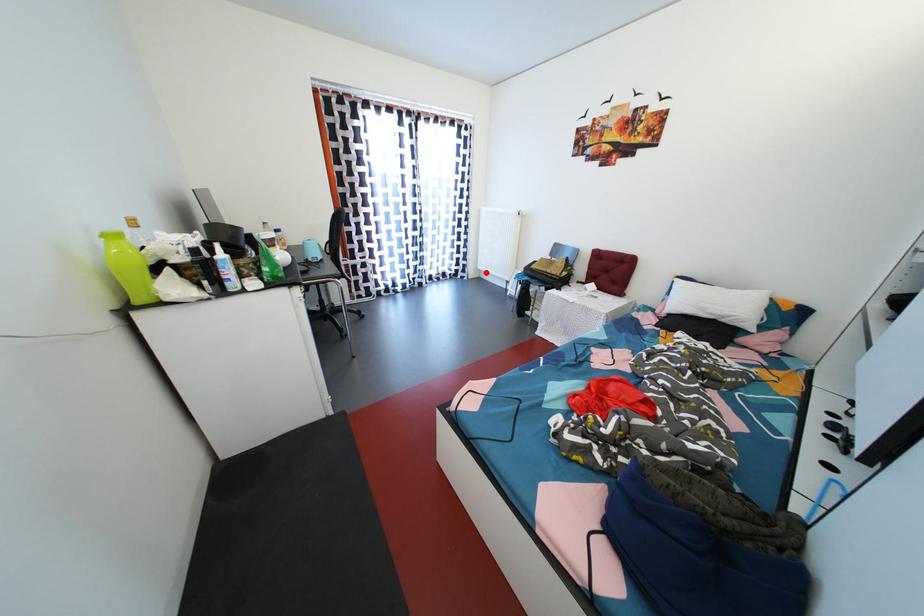
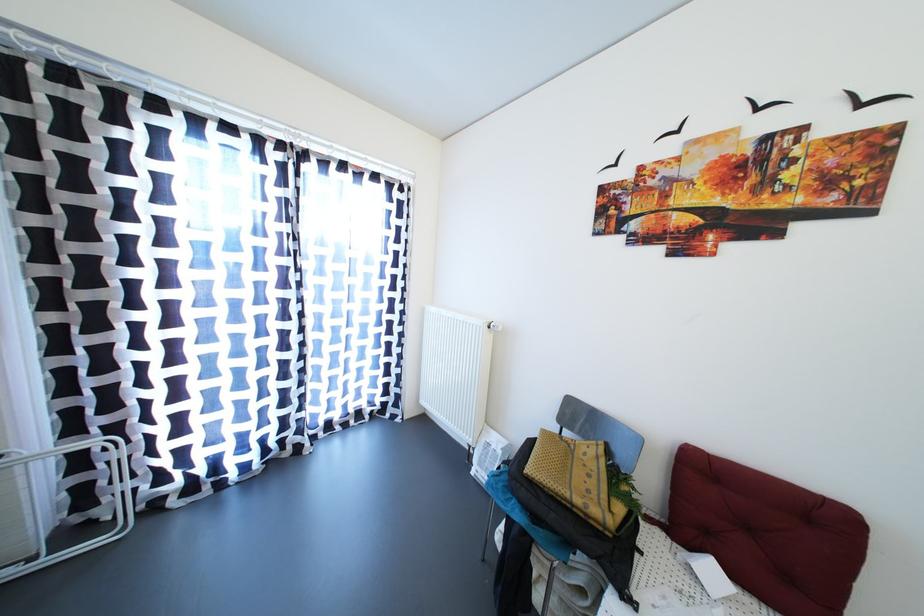
Question: A red point is marked in image1. In image2, is the corresponding 3D point closer to the camera or farther? Reply with the corresponding letter.

Choices:
 (A) The corresponding 3D point is closer.
 (B) The corresponding 3D point is farther.

Answer: (B)